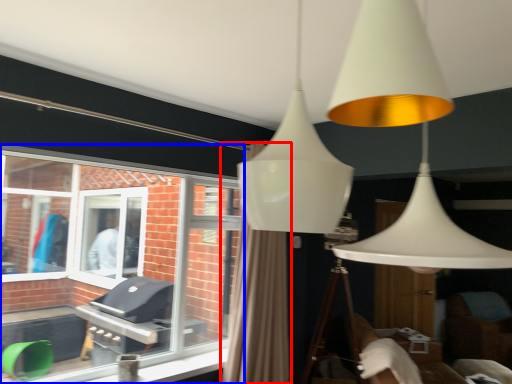
Question: Which point is further to the camera, curtain (highlighted by a red box) or window (highlighted by a blue box)?

Choices:
 (A) curtain
 (B) window

Answer: (A)